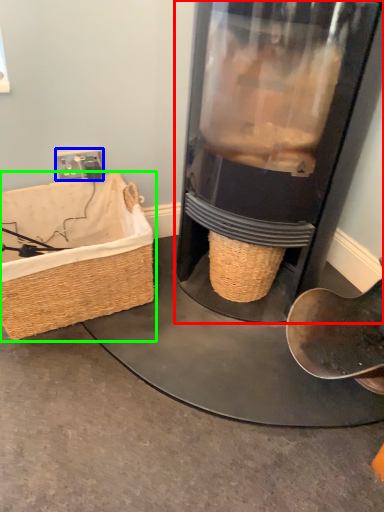
Question: Considering the real-world distances, which object is farthest from appliance (highlighted by a red box)? plug (highlighted by a blue box) or picnic basket (highlighted by a green box)?

Choices:
 (A) plug
 (B) picnic basket

Answer: (A)